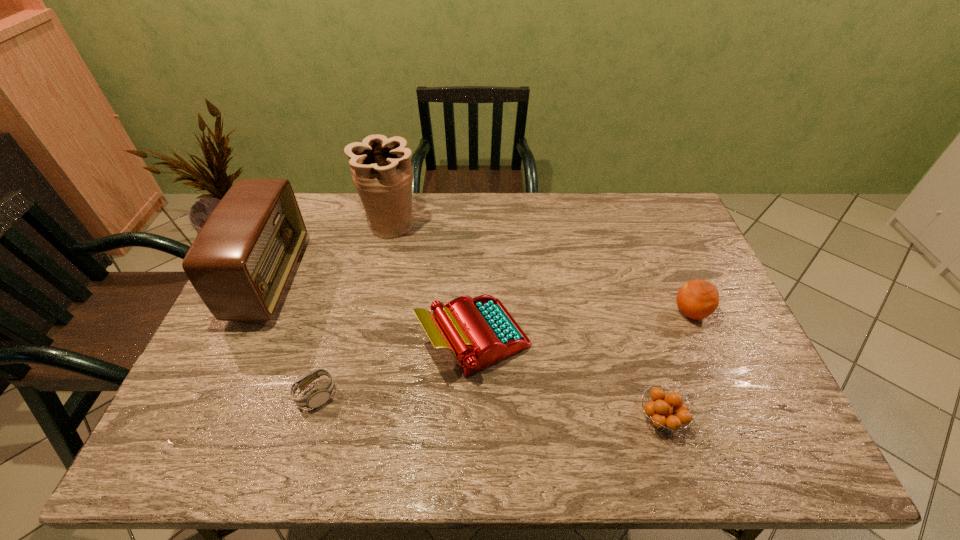
Locate which object is the fifth closest to the nearer orange fruit. Please provide its 2D coordinates. Your answer should be formatted as a tuple, i.e. [(x, y)], where the tuple contains the x and y coordinates of a point satisfying the conditions above.

[(240, 263)]

The height and width of the screenshot is (540, 960). I want to click on vacant position in the image that satisfies the following two spatial constraints: 1. on the front-facing side of the radio receiver; 2. on the left side of the shorter orange fruit, so click(x=206, y=419).

Locate an element on the screen. free space that satisfies the following two spatial constraints: 1. on the back side of the fourth tallest object; 2. on the front-facing side of the radio receiver is located at coordinates (676, 279).

Where is `free space that satisfies the following two spatial constraints: 1. on the front-facing side of the fifth tallest object; 2. on the left side of the leftmost object`? The image size is (960, 540). free space that satisfies the following two spatial constraints: 1. on the front-facing side of the fifth tallest object; 2. on the left side of the leftmost object is located at coordinates (206, 419).

This screenshot has height=540, width=960. Find the location of `free space that satisfies the following two spatial constraints: 1. on the back side of the left orange fruit; 2. on the left side of the taller orange fruit`. free space that satisfies the following two spatial constraints: 1. on the back side of the left orange fruit; 2. on the left side of the taller orange fruit is located at coordinates (628, 312).

At what (x,y) coordinates should I click in order to perform the action: click on free region that satisfies the following two spatial constraints: 1. on the back side of the second shortest object; 2. on the typing side of the third tallest object. Please return your answer as a coordinate pair (x, y). Looking at the image, I should click on coord(636,339).

The height and width of the screenshot is (540, 960). I want to click on free space that satisfies the following two spatial constraints: 1. on the face of the shortest object; 2. on the right side of the fifth tallest object, so click(x=308, y=419).

You are a GUI agent. You are given a task and a screenshot of the screen. Output one action in this format:
    pyautogui.click(x=<x>, y=<y>)
    Task: Click on the free spot that satisfies the following two spatial constraints: 1. on the front side of the farther orange fruit; 2. on the face of the shortest object
    The height and width of the screenshot is (540, 960).
    Given the screenshot: What is the action you would take?
    pyautogui.click(x=726, y=395)